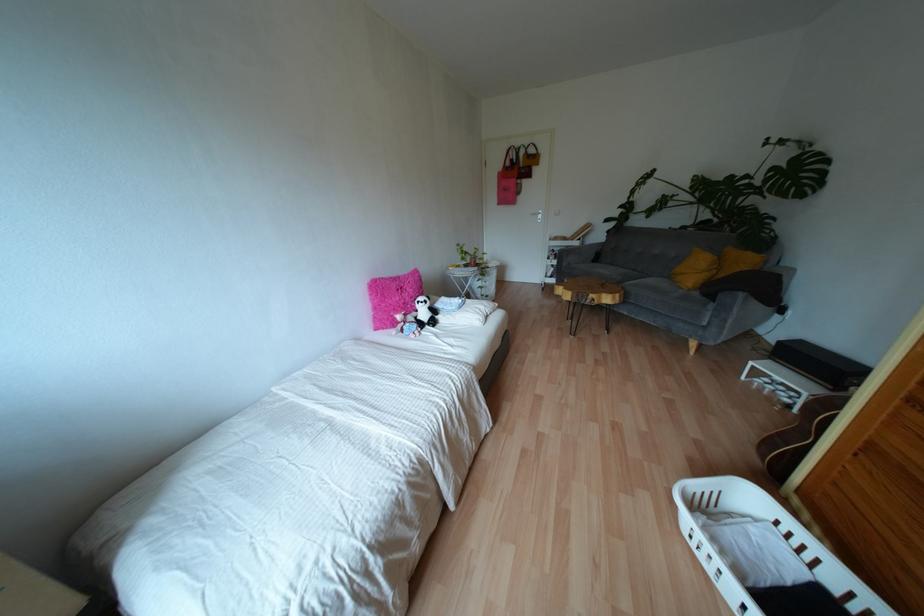
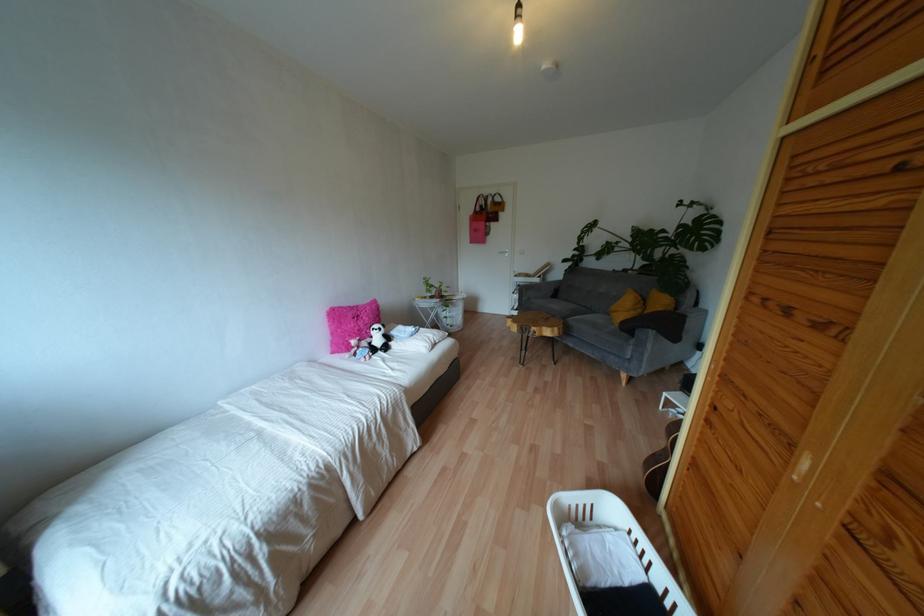
Find the pixel in the second image that matches the point at 438,304 in the first image.

(393, 331)